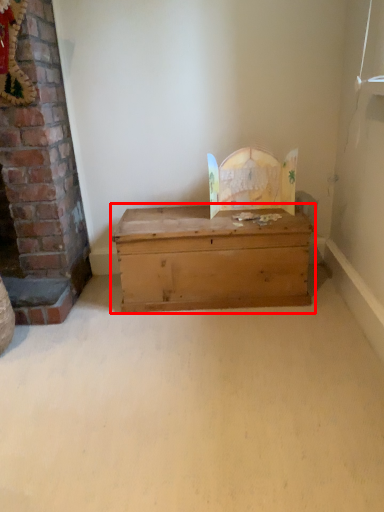
Question: In this image, where is table (annotated by the red box) located relative to fireplace?

Choices:
 (A) left
 (B) right

Answer: (B)